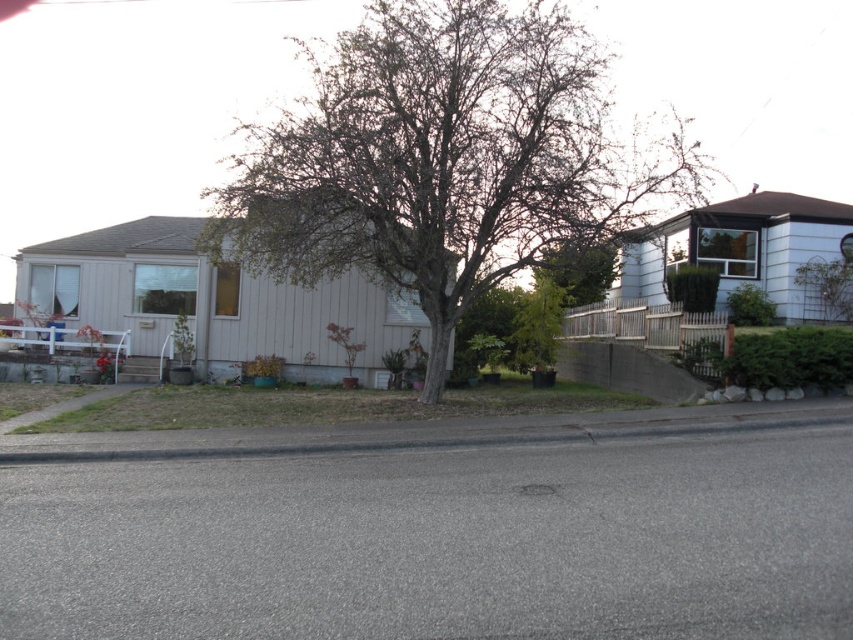
Is bare wood tree at center positioned behind green leafy tree at center?

That is False.

Which is below, bare wood tree at center or green leafy tree at center?

green leafy tree at center is lower down.

Between point (387, 70) and point (593, 246), which one is positioned in front?

Point (593, 246)

Where is `bare wood tree at center`? This screenshot has width=853, height=640. bare wood tree at center is located at coordinates (445, 157).